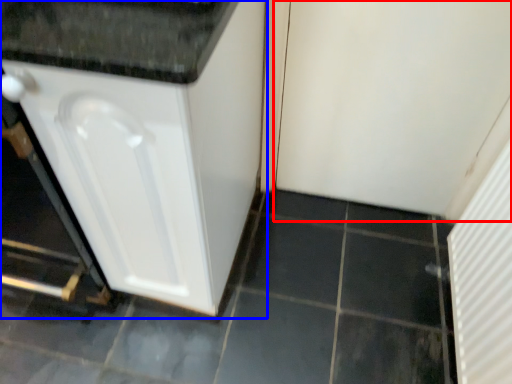
Question: Among these objects, which one is nearest to the camera, screen door (highlighted by a red box) or cabinetry (highlighted by a blue box)?

Choices:
 (A) screen door
 (B) cabinetry

Answer: (B)